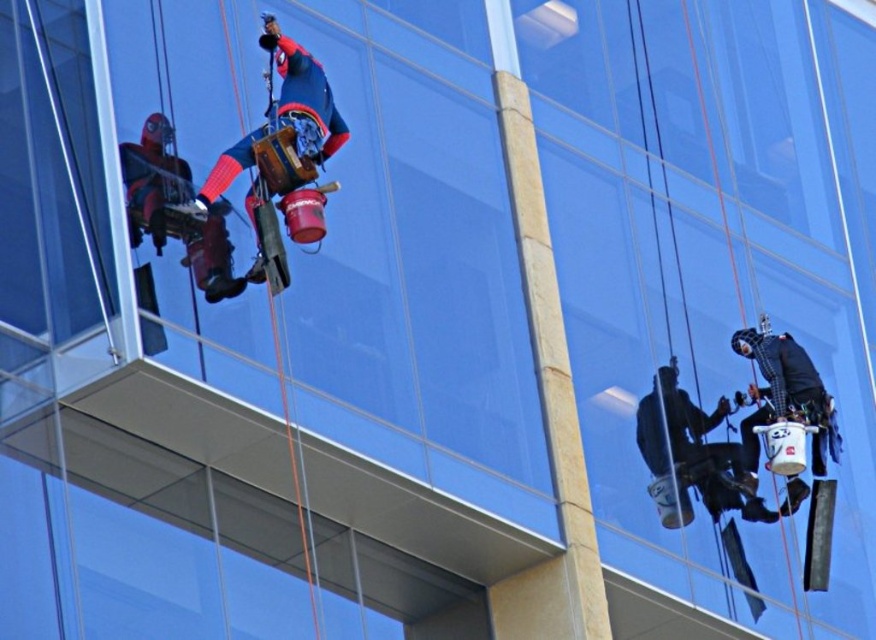
You are a safety inspector reviewing this scene. You need to ensure that the red fabric construction worker at upper left and the black matte construction worker at lower right are positioned safely. Based on their positions, which worker is closer to the building edge on the left side?

The red fabric construction worker at upper left is to the left of black matte construction worker at lower right, so the red fabric construction worker at upper left is closer to the building edge on the left side.

You are a safety inspector reviewing the scene of two construction workers on a glass building. You need to ensure that the workers are spaced appropriately for safety. Given that the red fabric construction worker at upper left is smaller in size than the black matte construction worker at lower right, which worker might be closer to the inspector, and why?

The red fabric construction worker at upper left is smaller in size compared to the black matte construction worker at lower right, which suggests that the red fabric construction worker at upper left is farther away from the inspector. In perspective, objects that are farther away appear smaller, so the smaller size indicates greater distance.

You are standing 200 feet away from the building. You see a point at coordinates point (318,144). Is this point closer to you than your current position?

The distance of point (318,144) from viewer is 232.91 feet, so the point is farther away than your current position of 200 feet.